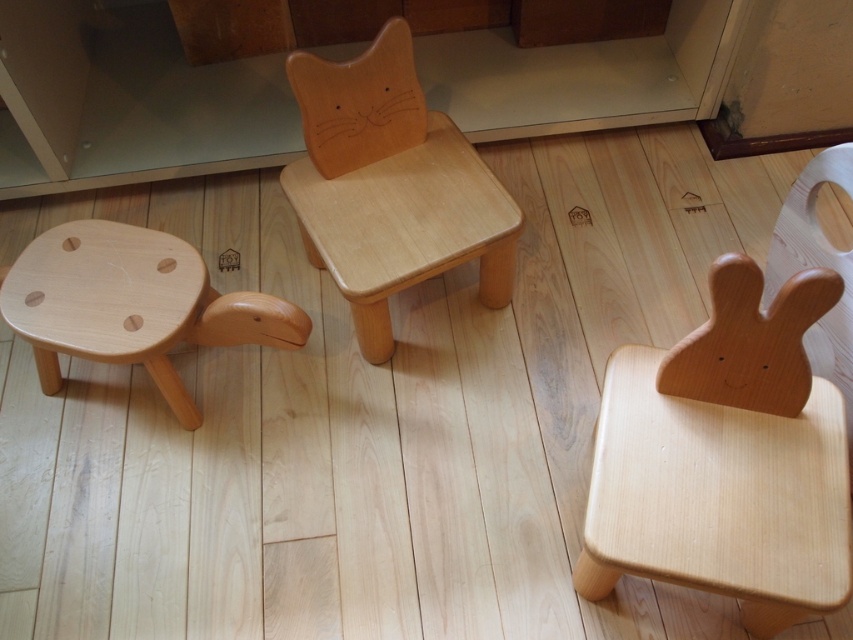
You are a parent trying to arrange these chairs for a play area. You want to place a toy box between the natural wood rabbit chair at right and the natural wood stool at left. Based on their positions, will the toy box be closer to the rabbit chair or the stool?

The natural wood rabbit chair at right is in front of the natural wood stool at left, so the toy box placed between them will be closer to the stool at left because the rabbit chair is positioned further forward.

You are standing at the center of the room and want to move to the natural wood rabbit chair at right. Which direction should you walk to reach it?

Since the natural wood rabbit chair at right is located at point (733,440) in 2D coordinates, you should walk towards the right side of the room to reach it.